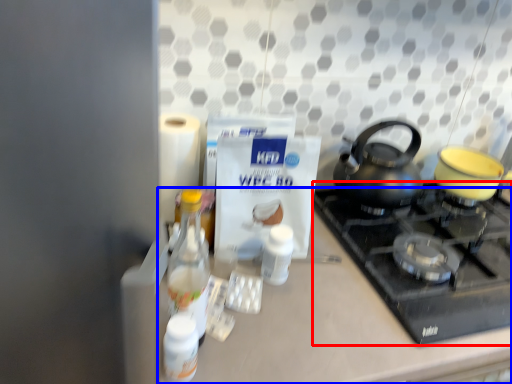
Question: Which point is further to the camera, gas stove (highlighted by a red box) or counter (highlighted by a blue box)?

Choices:
 (A) gas stove
 (B) counter

Answer: (A)